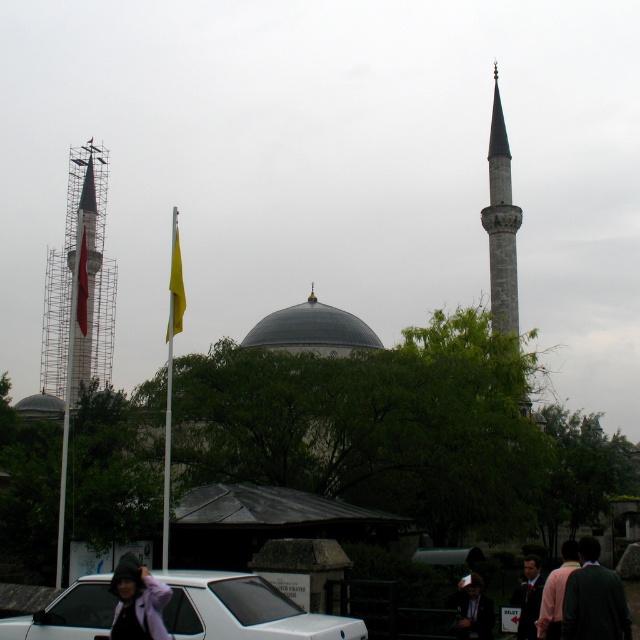
Who is more distant from viewer, (92, 237) or (560, 627)?

Positioned behind is point (92, 237).

Can you confirm if metallic scaffolding tower at left is taller than pink fabric at lower right?

Indeed, metallic scaffolding tower at left has a greater height compared to pink fabric at lower right.

Is point (65, 316) farther from camera compared to point (554, 620)?

Yes, point (65, 316) is farther from viewer.

Image resolution: width=640 pixels, height=640 pixels. Identify the location of metallic scaffolding tower at left. (88, 282).

Does white matte car at lower center appear under metallic scaffolding tower at left?

Indeed, white matte car at lower center is positioned under metallic scaffolding tower at left.

Between white matte car at lower center and metallic scaffolding tower at left, which one is positioned lower?

white matte car at lower center is below.

Between point (308, 614) and point (99, 236), which one is positioned in front?

Point (308, 614) is in front.

Where is `white matte car at lower center`? The width and height of the screenshot is (640, 640). white matte car at lower center is located at coordinates (243, 609).

Who is lower down, gray stone minaret at right or shiny metallic dome at center?

Positioned lower is shiny metallic dome at center.

Can you confirm if gray stone minaret at right is bigger than shiny metallic dome at center?

Yes, gray stone minaret at right is bigger than shiny metallic dome at center.

Describe the element at coordinates (500, 225) in the screenshot. I see `gray stone minaret at right` at that location.

Image resolution: width=640 pixels, height=640 pixels. In order to click on gray stone minaret at right in this screenshot , I will do `click(500, 225)`.